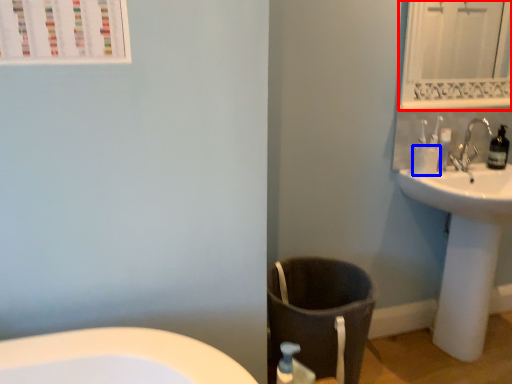
Question: Among these objects, which one is farthest to the camera, mirror (highlighted by a red box) or toilet paper (highlighted by a blue box)?

Choices:
 (A) mirror
 (B) toilet paper

Answer: (B)